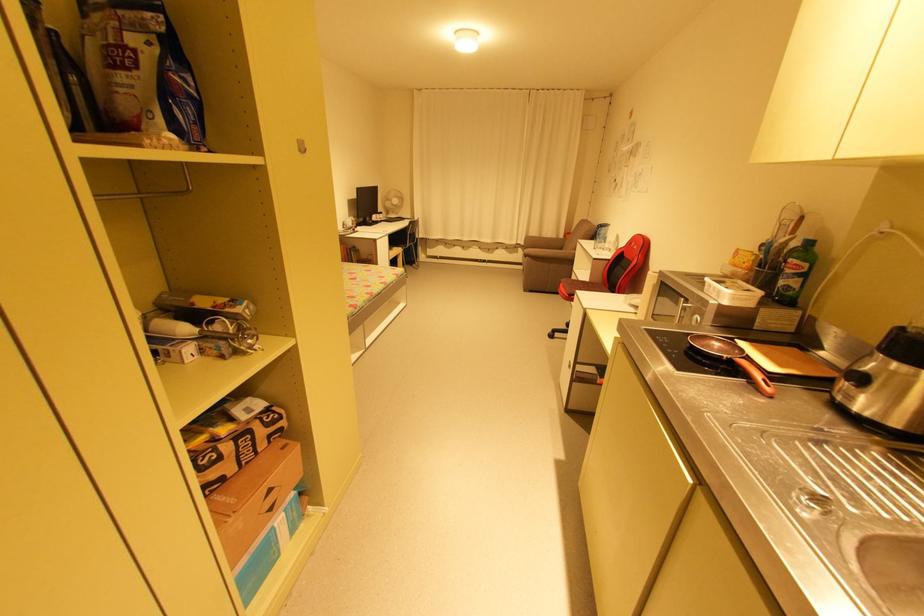
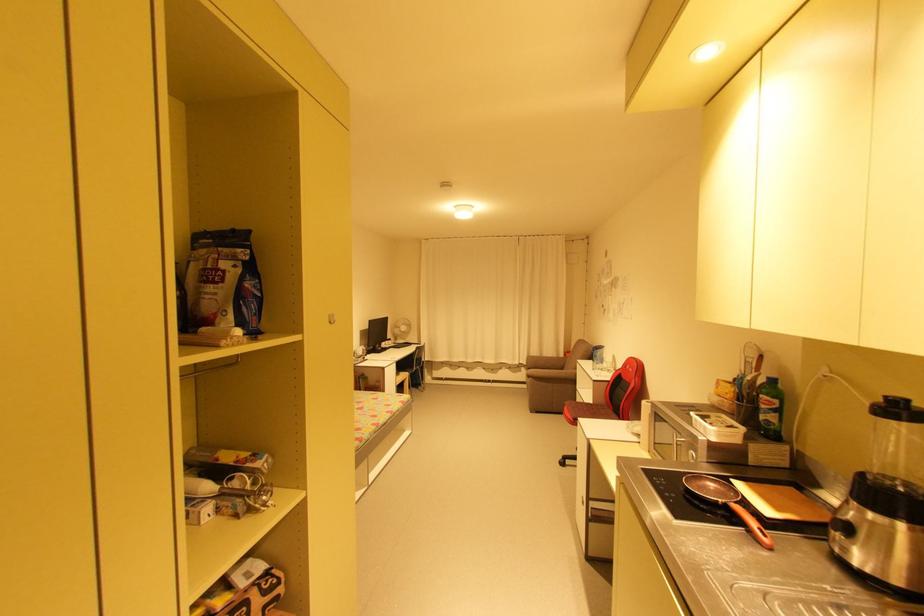
Question: Which direction would the cameraman need to move to produce the second image? Reply with the corresponding letter.

Choices:
 (A) Left
 (B) Right
 (C) Forward
 (D) Backward

Answer: (D)